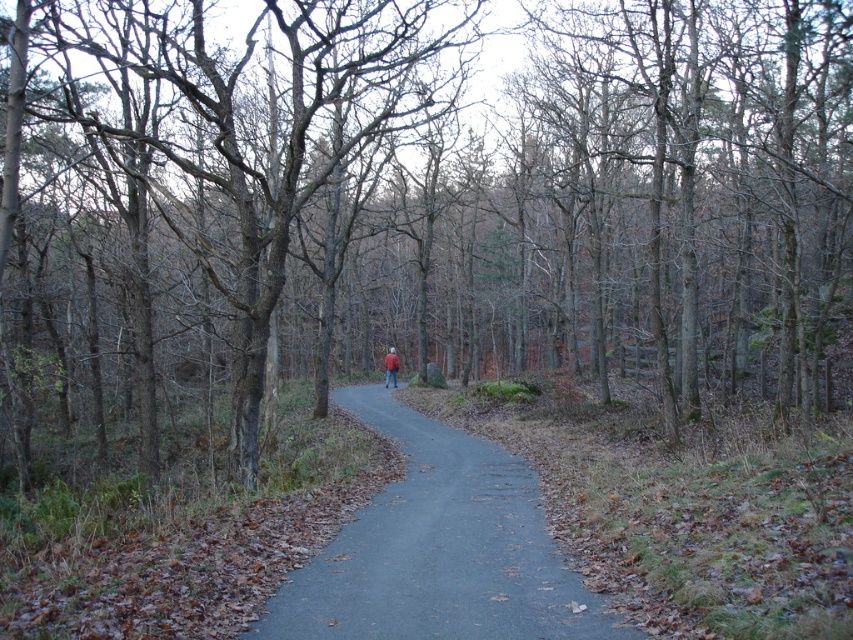
Question: Which point appears farthest from the camera in this image?

Choices:
 (A) (334, 628)
 (B) (396, 378)

Answer: (B)

Question: Does smooth asphalt path at center have a greater width compared to red jacket at center?

Choices:
 (A) yes
 (B) no

Answer: (A)

Question: Does smooth asphalt path at center appear under red jacket at center?

Choices:
 (A) yes
 (B) no

Answer: (A)

Question: Among these points, which one is nearest to the camera?

Choices:
 (A) (386, 387)
 (B) (296, 605)

Answer: (B)

Question: Which of the following is the closest to the observer?

Choices:
 (A) (395, 378)
 (B) (451, 618)

Answer: (B)

Question: Is smooth asphalt path at center to the left of red jacket at center from the viewer's perspective?

Choices:
 (A) yes
 (B) no

Answer: (B)